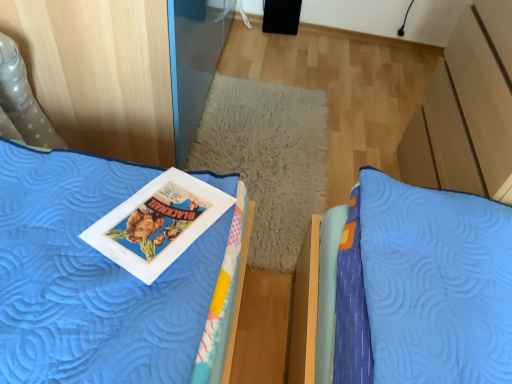
Question: Are blue quilted bed at upper left and matte paper comic book at center-left far apart?

Choices:
 (A) yes
 (B) no

Answer: (B)

Question: Does blue quilted bed at upper left have a greater height compared to matte paper comic book at center-left?

Choices:
 (A) yes
 (B) no

Answer: (A)

Question: Is blue quilted bed at upper left not inside matte paper comic book at center-left?

Choices:
 (A) no
 (B) yes

Answer: (B)

Question: Is blue quilted bed at upper left positioned in front of matte paper comic book at center-left?

Choices:
 (A) no
 (B) yes

Answer: (B)

Question: Is blue quilted bed at upper left further to camera compared to matte paper comic book at center-left?

Choices:
 (A) yes
 (B) no

Answer: (B)

Question: From the image's perspective, is blue quilted pillow at center positioned above or below blue quilted bed at upper left?

Choices:
 (A) below
 (B) above

Answer: (B)

Question: Is blue quilted pillow at center spatially inside blue quilted bed at upper left, or outside of it?

Choices:
 (A) outside
 (B) inside

Answer: (A)

Question: Considering the positions of blue quilted pillow at center and blue quilted bed at upper left in the image, is blue quilted pillow at center wider or thinner than blue quilted bed at upper left?

Choices:
 (A) wide
 (B) thin

Answer: (A)

Question: Considering the positions of point (236, 162) and point (215, 291), is point (236, 162) closer or farther from the camera than point (215, 291)?

Choices:
 (A) closer
 (B) farther

Answer: (B)

Question: Considering the relative positions of matte paper comic book at center-left and blue quilted bed at upper left in the image provided, is matte paper comic book at center-left to the left or to the right of blue quilted bed at upper left?

Choices:
 (A) right
 (B) left

Answer: (A)

Question: In terms of size, does matte paper comic book at center-left appear bigger or smaller than blue quilted bed at upper left?

Choices:
 (A) big
 (B) small

Answer: (B)

Question: Relative to blue quilted bed at upper left, is matte paper comic book at center-left in front or behind?

Choices:
 (A) front
 (B) behind

Answer: (B)

Question: Is point (138, 266) positioned closer to the camera than point (225, 251)?

Choices:
 (A) farther
 (B) closer

Answer: (B)

Question: In terms of width, does blue quilted bed at upper left look wider or thinner when compared to blue quilted pillow at center?

Choices:
 (A) thin
 (B) wide

Answer: (A)

Question: Relative to blue quilted pillow at center, is blue quilted bed at upper left in front or behind?

Choices:
 (A) behind
 (B) front

Answer: (B)